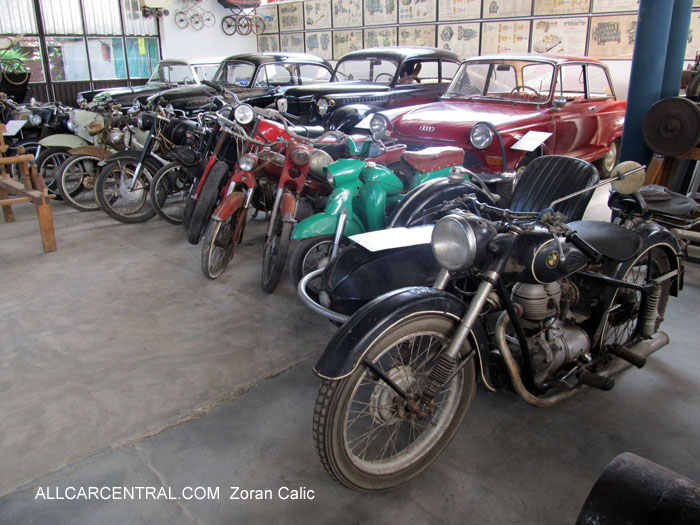
Find the location of a particular element. This screenshot has height=525, width=700. floor is located at coordinates (99, 353).